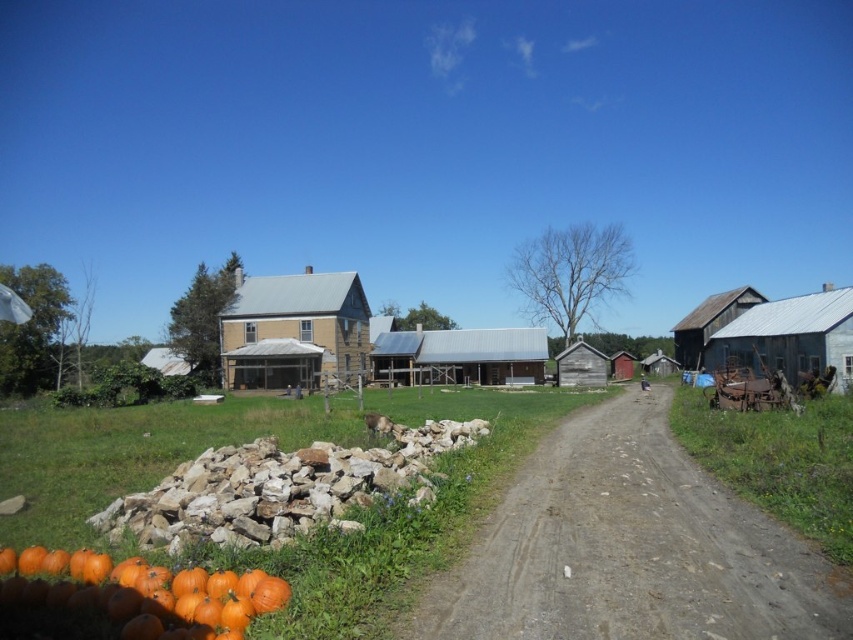
Describe the element at coordinates (460, 356) in the screenshot. Image resolution: width=853 pixels, height=640 pixels. I see `metallic gray barn at center` at that location.

Is metallic gray barn at center thinner than weathered wood barn at center?

In fact, metallic gray barn at center might be wider than weathered wood barn at center.

At what (x,y) coordinates should I click in order to perform the action: click on metallic gray barn at center. Please return your answer as a coordinate pair (x, y). The width and height of the screenshot is (853, 640). Looking at the image, I should click on (460, 356).

Locate an element on the screen. metallic gray barn at center is located at coordinates (460, 356).

Is beige wooden barn at center positioned at the back of rusty metal barn at right?

Yes, beige wooden barn at center is behind rusty metal barn at right.

Between point (357, 308) and point (779, 349), which one is positioned behind?

Positioned behind is point (357, 308).

Image resolution: width=853 pixels, height=640 pixels. I want to click on beige wooden barn at center, so click(x=293, y=330).

Between beige wooden barn at center and metallic gray barn at center, which one has more height?

With more height is beige wooden barn at center.

Which is more to the left, beige wooden barn at center or metallic gray barn at center?

beige wooden barn at center is more to the left.

Which is in front, point (264, 324) or point (418, 340)?

Point (264, 324) is in front.

At what (x,y) coordinates should I click in order to perform the action: click on beige wooden barn at center. Please return your answer as a coordinate pair (x, y). This screenshot has height=640, width=853. Looking at the image, I should click on (293, 330).